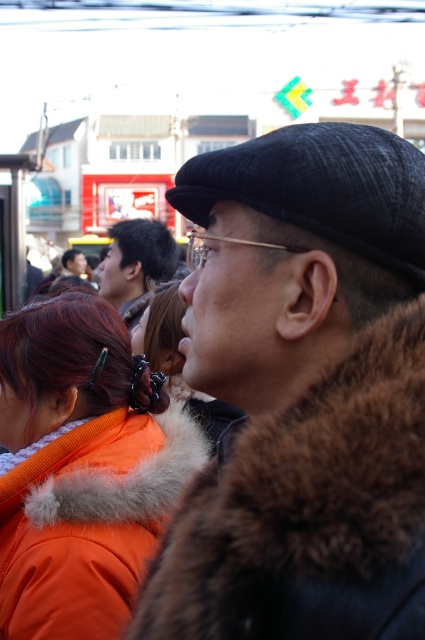
Does orange fur coat at center have a smaller size compared to dark brown hair at center?

Indeed, orange fur coat at center has a smaller size compared to dark brown hair at center.

Does orange fur coat at center have a greater width compared to dark brown hair at center?

No.

Who is more forward, [73,588] or [167,268]?

Point [73,588] is more forward.

This screenshot has height=640, width=425. What are the coordinates of `orange fur coat at center` in the screenshot? It's located at (82, 470).

Is fur-lined jacket at center smaller than dark brown hair at center?

Yes.

Does point (388, 323) lie in front of point (116, 282)?

That is True.

Identify the location of fur-lined jacket at center. This screenshot has width=425, height=640. (302, 394).

Does fur-lined jacket at center have a greater width compared to orange fur coat at center?

Indeed, fur-lined jacket at center has a greater width compared to orange fur coat at center.

Which is above, fur-lined jacket at center or orange fur coat at center?

fur-lined jacket at center is above.

Where is `fur-lined jacket at center`? fur-lined jacket at center is located at coordinates (302, 394).